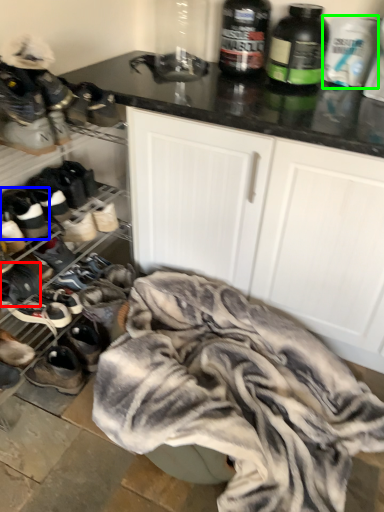
Question: Considering the real-world distances, which object is closest to footwear (highlighted by a red box)? footwear (highlighted by a blue box) or bottle (highlighted by a green box).

Choices:
 (A) footwear
 (B) bottle

Answer: (A)